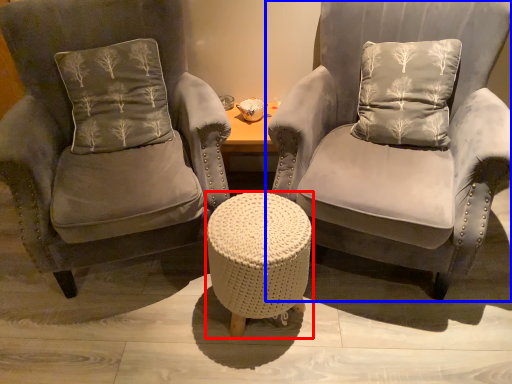
Question: Which point is closer to the camera, table (highlighted by a red box) or chair (highlighted by a blue box)?

Choices:
 (A) table
 (B) chair

Answer: (B)